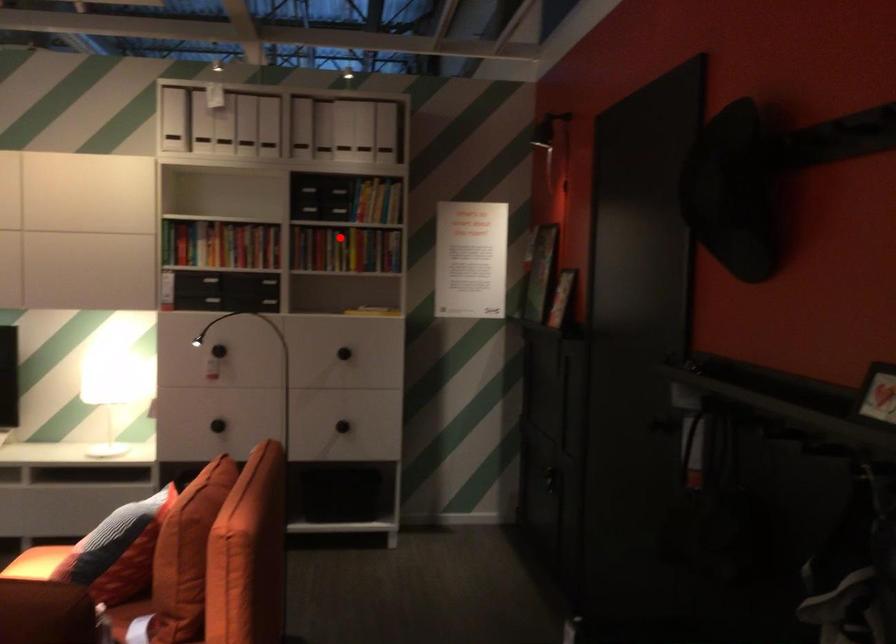
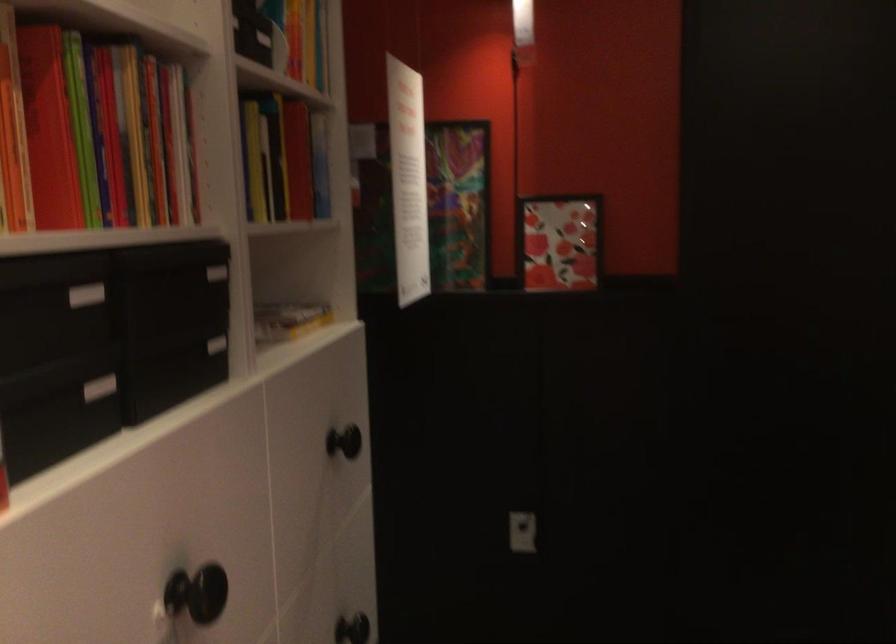
Question: I am providing you with two images of the same scene from different viewpoints. Given a red point in image1, look at the same physical point in image2. Is it:

Choices:
 (A) Closer to the viewpoint
 (B) Farther from the viewpoint

Answer: (A)